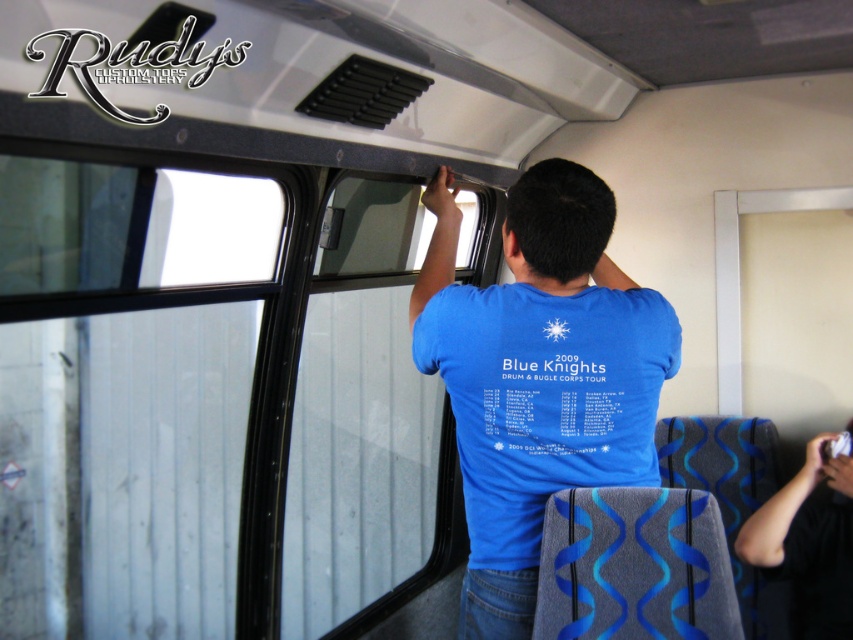
Question: Can you confirm if blue matte shirt at upper center is thinner than blue fabric shirt at upper center?

Choices:
 (A) no
 (B) yes

Answer: (A)

Question: Does blue matte shirt at upper center have a greater width compared to blue fabric shirt at upper center?

Choices:
 (A) no
 (B) yes

Answer: (B)

Question: Can you confirm if blue matte shirt at upper center is positioned to the left of blue fabric shirt at upper center?

Choices:
 (A) yes
 (B) no

Answer: (A)

Question: Among these objects, which one is farthest from the camera?

Choices:
 (A) blue matte shirt at upper center
 (B) blue fabric shirt at upper center

Answer: (B)

Question: Which point appears closest to the camera in this image?

Choices:
 (A) (750, 518)
 (B) (630, 476)

Answer: (B)